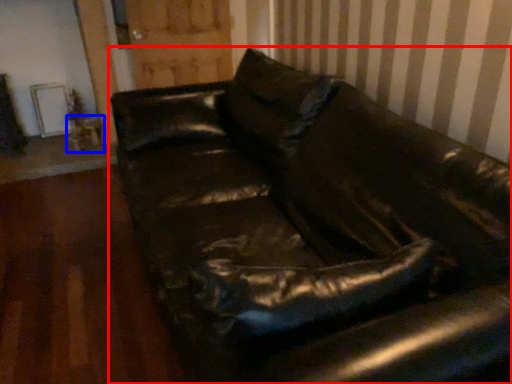
Question: Among these objects, which one is farthest to the camera, studio couch (highlighted by a red box) or table (highlighted by a blue box)?

Choices:
 (A) studio couch
 (B) table

Answer: (B)